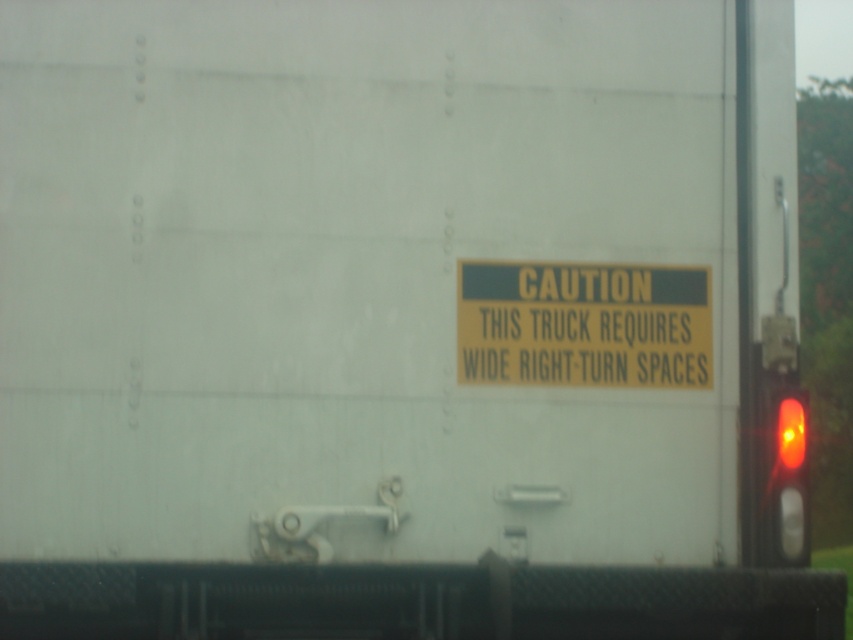
Does yellow paper sign at center lie in front of amber glass traffic light at right?

That is True.

Can you confirm if yellow paper sign at center is bigger than amber glass traffic light at right?

Indeed, yellow paper sign at center has a larger size compared to amber glass traffic light at right.

Which is in front, point (462, 380) or point (795, 554)?

Positioned in front is point (462, 380).

The image size is (853, 640). What are the coordinates of `yellow paper sign at center` in the screenshot? It's located at (583, 324).